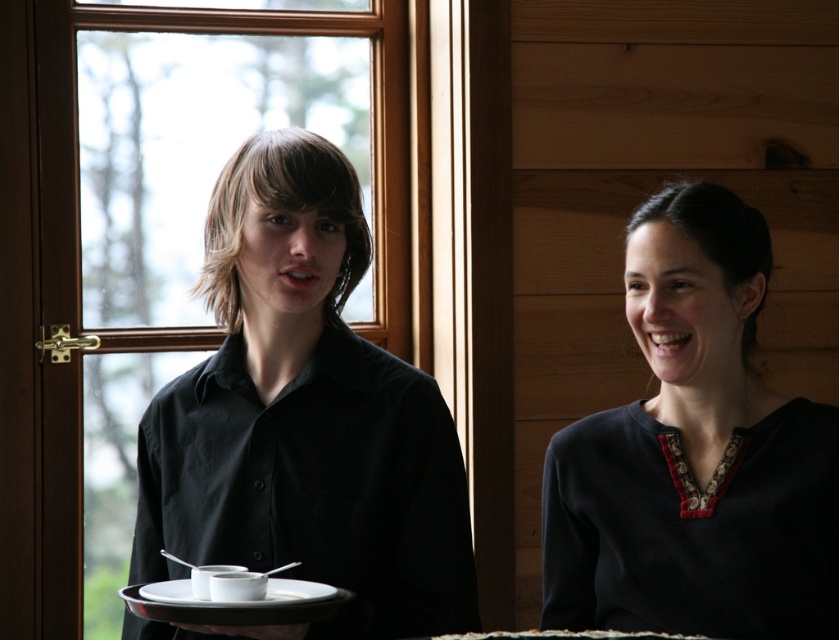
Is black matte shirt at center bigger than dark blue fabric at center?

Indeed, black matte shirt at center has a larger size compared to dark blue fabric at center.

Who is positioned more to the right, black matte shirt at center or dark blue fabric at center?

From the viewer's perspective, dark blue fabric at center appears more on the right side.

What do you see at coordinates (305, 417) in the screenshot?
I see `black matte shirt at center` at bounding box center [305, 417].

Find the location of a particular element. The height and width of the screenshot is (640, 839). black matte shirt at center is located at coordinates (305, 417).

Is black matte shirt at center shorter than white matte saucer at center?

No.

Who is more distant from viewer, [185,528] or [189,593]?

Positioned behind is point [185,528].

The height and width of the screenshot is (640, 839). I want to click on black matte shirt at center, so click(305, 417).

Can you confirm if dark blue fabric at center is positioned above white matte saucer at center?

Yes, dark blue fabric at center is above white matte saucer at center.

Which is below, dark blue fabric at center or white matte saucer at center?

white matte saucer at center

Which is in front, point (727, 310) or point (243, 592)?

Point (243, 592)

Find the location of `dark blue fabric at center`. dark blue fabric at center is located at coordinates (696, 454).